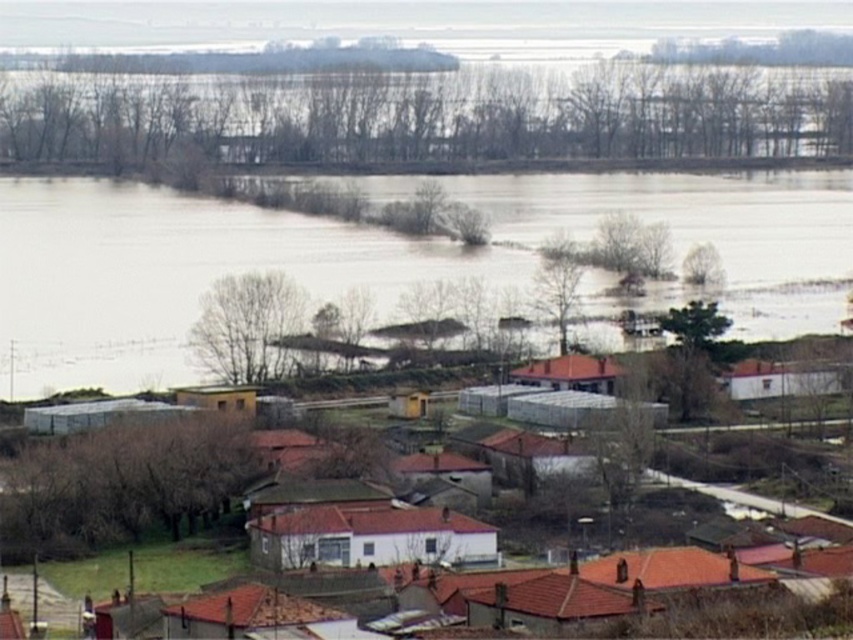
You are a drone operator assessing flood damage. You need to determine if the brown muddy water at center has risen above the white matte building at center. Based on the scene, what can you conclude?

The brown muddy water at center is much taller than the white matte building at center, indicating that the water level has indeed risen above the building.

You are a rescue drone operator trying to assess the flooded area. You need to determine if a rescue boat can navigate between the point at coordinates point (x=602, y=328) and the nearest building. The boat requires a minimum of 200 meters of open water to maneuver safely. Is there enough space?

The distance between point (x=602, y=328) and the camera is 386.80 meters. Since the boat requires 200 meters of open water, there is sufficient space for safe maneuvering.

You are a rescue worker trying to navigate through the flooded area. You see the brown muddy water at center and the white matte building at center. Which direction should you avoid to prevent getting stuck in the mud?

You should avoid going to the right of the white matte building at center because the brown muddy water at center is located there, which may pose a risk of getting stuck in the mud.